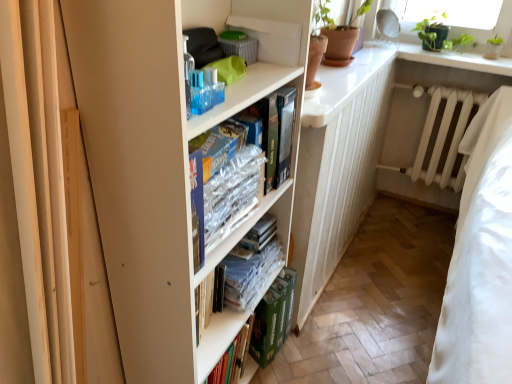
Where is `vacant area on top of white glossy counter top at upper right (from a real-world perspective)`? vacant area on top of white glossy counter top at upper right (from a real-world perspective) is located at coordinates (357, 61).